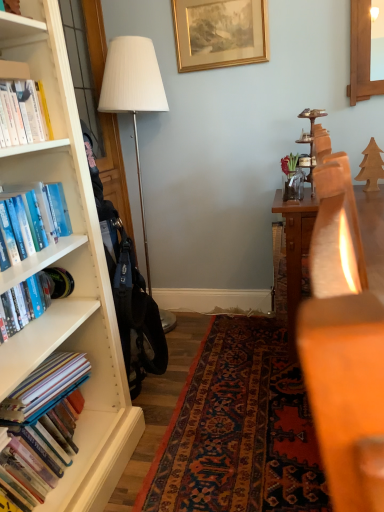
Question: Is gold metallic picture frame at upper center at the back of hardcover book at left, placed as the 2th book when sorted from top to bottom?

Choices:
 (A) yes
 (B) no

Answer: (B)

Question: Can you confirm if hardcover book at left, placed as the 2th book when sorted from top to bottom, is bigger than gold metallic picture frame at upper center?

Choices:
 (A) no
 (B) yes

Answer: (A)

Question: From the image's perspective, is hardcover book at left, which is counted as the third book, starting from the bottom, on top of gold metallic picture frame at upper center?

Choices:
 (A) yes
 (B) no

Answer: (B)

Question: From a real-world perspective, is hardcover book at left, placed as the 2th book when sorted from top to bottom, located higher than gold metallic picture frame at upper center?

Choices:
 (A) yes
 (B) no

Answer: (B)

Question: Can you confirm if hardcover book at left, placed as the 2th book when sorted from top to bottom, is positioned to the right of gold metallic picture frame at upper center?

Choices:
 (A) yes
 (B) no

Answer: (B)

Question: From the image's perspective, is blue hardcover book at left, the 4th book in the bottom-to-top sequence, located above or below gold metallic picture frame at upper center?

Choices:
 (A) above
 (B) below

Answer: (B)

Question: Does point (29, 215) appear closer or farther from the camera than point (178, 68)?

Choices:
 (A) closer
 (B) farther

Answer: (A)

Question: Would you say blue hardcover book at left, the first book viewed from the top, is to the left or to the right of gold metallic picture frame at upper center in the picture?

Choices:
 (A) left
 (B) right

Answer: (A)

Question: From a real-world perspective, is blue hardcover book at left, the first book viewed from the top, physically located above or below gold metallic picture frame at upper center?

Choices:
 (A) above
 (B) below

Answer: (B)

Question: Is point (254, 57) closer or farther from the camera than point (77, 382)?

Choices:
 (A) closer
 (B) farther

Answer: (B)

Question: Based on their positions, is gold metallic picture frame at upper center located to the left or right of hardcover books at left, arranged as the third book when viewed from the top?

Choices:
 (A) left
 (B) right

Answer: (B)

Question: Considering the positions of gold metallic picture frame at upper center and hardcover books at left, arranged as the second book when ordered from the bottom, in the image, is gold metallic picture frame at upper center bigger or smaller than hardcover books at left, arranged as the second book when ordered from the bottom,?

Choices:
 (A) big
 (B) small

Answer: (B)

Question: In terms of width, does gold metallic picture frame at upper center look wider or thinner when compared to hardcover books at left, arranged as the third book when viewed from the top?

Choices:
 (A) thin
 (B) wide

Answer: (A)

Question: Considering the positions of white fabric lampshade at left and gold metallic picture frame at upper center in the image, is white fabric lampshade at left taller or shorter than gold metallic picture frame at upper center?

Choices:
 (A) tall
 (B) short

Answer: (A)

Question: In the image, is white fabric lampshade at left on the left side or the right side of gold metallic picture frame at upper center?

Choices:
 (A) left
 (B) right

Answer: (A)